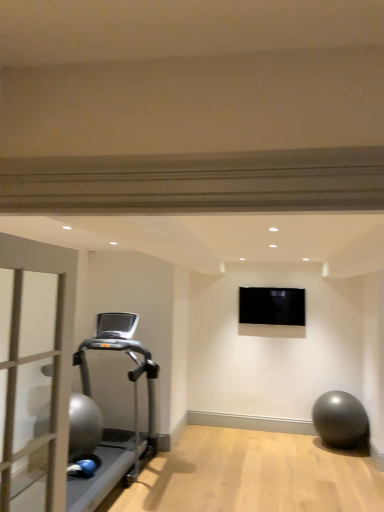
Question: Considering the relative sizes of silver metallic treadmill at left and black glossy tv at upper center in the image provided, is silver metallic treadmill at left taller than black glossy tv at upper center?

Choices:
 (A) yes
 (B) no

Answer: (A)

Question: Is black glossy tv at upper center inside silver metallic treadmill at left?

Choices:
 (A) no
 (B) yes

Answer: (A)

Question: From a real-world perspective, is silver metallic treadmill at left beneath black glossy tv at upper center?

Choices:
 (A) yes
 (B) no

Answer: (A)

Question: Is the position of silver metallic treadmill at left more distant than that of black glossy tv at upper center?

Choices:
 (A) yes
 (B) no

Answer: (B)

Question: From the image's perspective, is silver metallic treadmill at left under black glossy tv at upper center?

Choices:
 (A) no
 (B) yes

Answer: (B)

Question: Is silver metallic treadmill at left bigger or smaller than matte gray door at left?

Choices:
 (A) small
 (B) big

Answer: (B)

Question: From a real-world perspective, is silver metallic treadmill at left above or below matte gray door at left?

Choices:
 (A) above
 (B) below

Answer: (B)

Question: Relative to matte gray door at left, is silver metallic treadmill at left in front or behind?

Choices:
 (A) front
 (B) behind

Answer: (B)

Question: From the image's perspective, is silver metallic treadmill at left located above or below matte gray door at left?

Choices:
 (A) above
 (B) below

Answer: (B)

Question: Based on their sizes in the image, would you say black glossy tv at upper center is bigger or smaller than silver metallic treadmill at left?

Choices:
 (A) big
 (B) small

Answer: (B)

Question: Is black glossy tv at upper center situated inside silver metallic treadmill at left or outside?

Choices:
 (A) outside
 (B) inside

Answer: (A)

Question: Considering the positions of black glossy tv at upper center and silver metallic treadmill at left in the image, is black glossy tv at upper center wider or thinner than silver metallic treadmill at left?

Choices:
 (A) thin
 (B) wide

Answer: (A)

Question: From the image's perspective, is black glossy tv at upper center located above or below silver metallic treadmill at left?

Choices:
 (A) below
 (B) above

Answer: (B)

Question: Is black glossy tv at upper center to the left or to the right of metallic gray ball at lower right in the image?

Choices:
 (A) left
 (B) right

Answer: (A)

Question: In terms of width, does black glossy tv at upper center look wider or thinner when compared to metallic gray ball at lower right?

Choices:
 (A) wide
 (B) thin

Answer: (B)